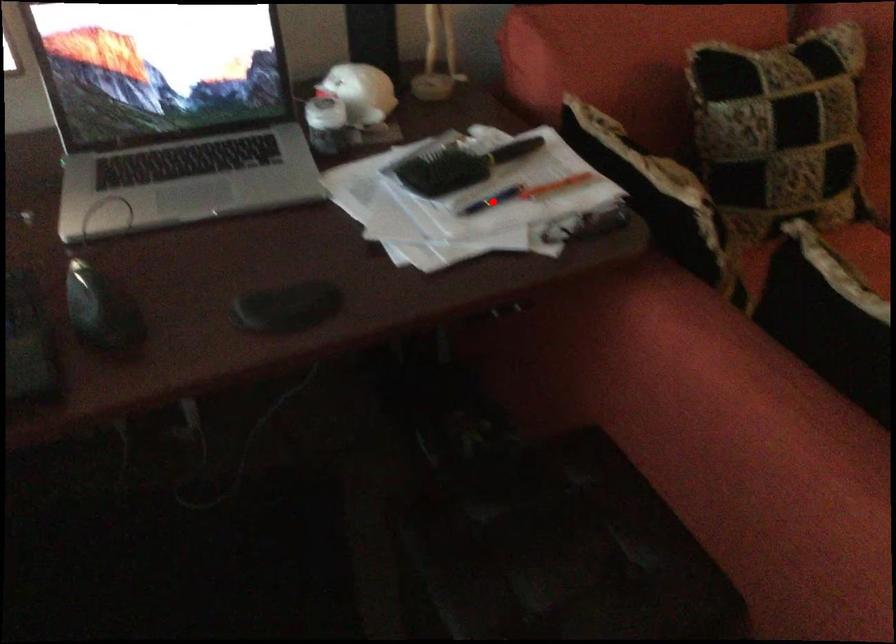
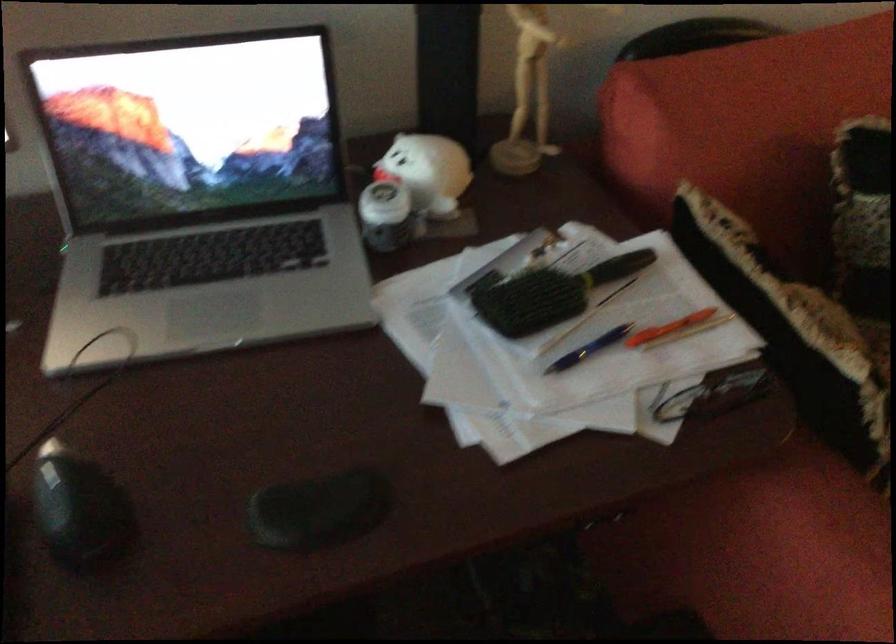
Where in the second image is the point corresponding to the highlighted location from the first image?

(589, 348)